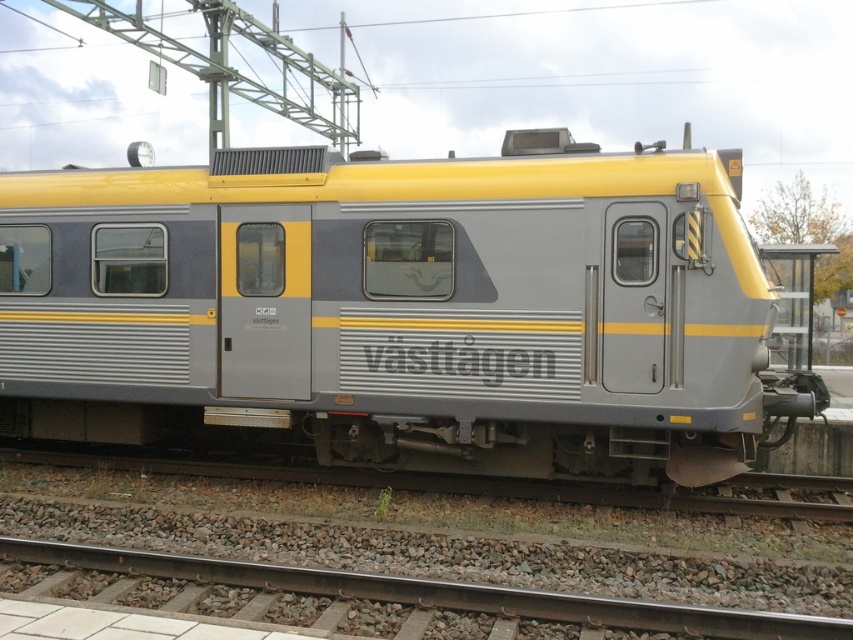
Who is positioned more to the left, metallic gray train at center or gravel at lower center?

Positioned to the left is gravel at lower center.

Consider the image. Who is more forward, (451, 312) or (242, 602)?

Point (242, 602) is in front.

Which is behind, point (773, 314) or point (144, 572)?

The point (773, 314) is behind.

Identify the location of metallic gray train at center. (402, 308).